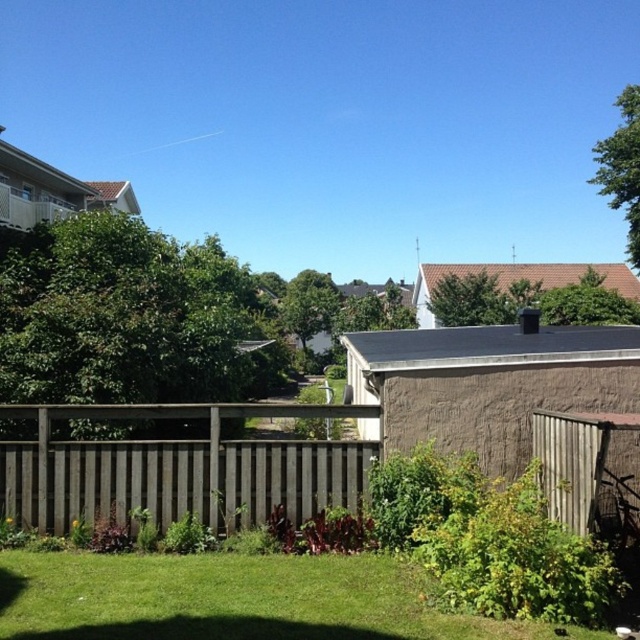
You are standing at the center of the image and want to walk towards the green grass at lower center. What are the coordinates where you should aim to step on?

You should aim to step on the coordinates point at (228, 598) where the green grass at lower center is located.

You are planning to install a new garden bed between the green grass at lower center and the weathered wood fence at center. Based on their widths, which area would be more suitable for placing the garden bed?

The green grass at lower center might be wider than the weathered wood fence at center, so the garden bed would be more suitable for the area near the green grass at lower center since it has more space.

You are standing at the point marked by the coordinate (228, 598) in the suburban scene. What do you see directly below you?

The point at coordinate (228, 598) indicates green grass at lower center, so you are standing on the green grass at lower center.